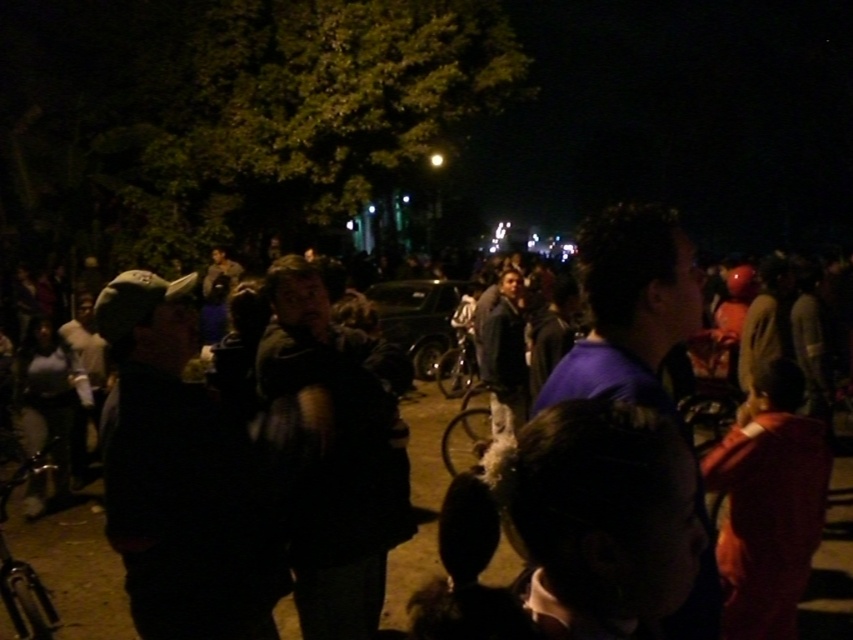
Question: Which of the following is the closest to the observer?

Choices:
 (A) dark blue jacket at center
 (B) shiny metallic bicycle at lower left

Answer: (B)

Question: Which point appears farthest from the camera in this image?

Choices:
 (A) (827, 582)
 (B) (10, 480)

Answer: (A)

Question: Can you confirm if dark blue jacket at center is wider than shiny metallic bicycle at lower left?

Choices:
 (A) yes
 (B) no

Answer: (B)

Question: Can you confirm if dark blue jacket at center is bigger than shiny metallic bicycle at lower left?

Choices:
 (A) yes
 (B) no

Answer: (B)

Question: Observing the image, what is the correct spatial positioning of dark blue jacket at center in reference to shiny metallic bicycle at lower left?

Choices:
 (A) below
 (B) above

Answer: (A)

Question: Which point is farther to the camera?

Choices:
 (A) shiny metallic bicycle at lower left
 (B) dark blue jacket at center

Answer: (B)